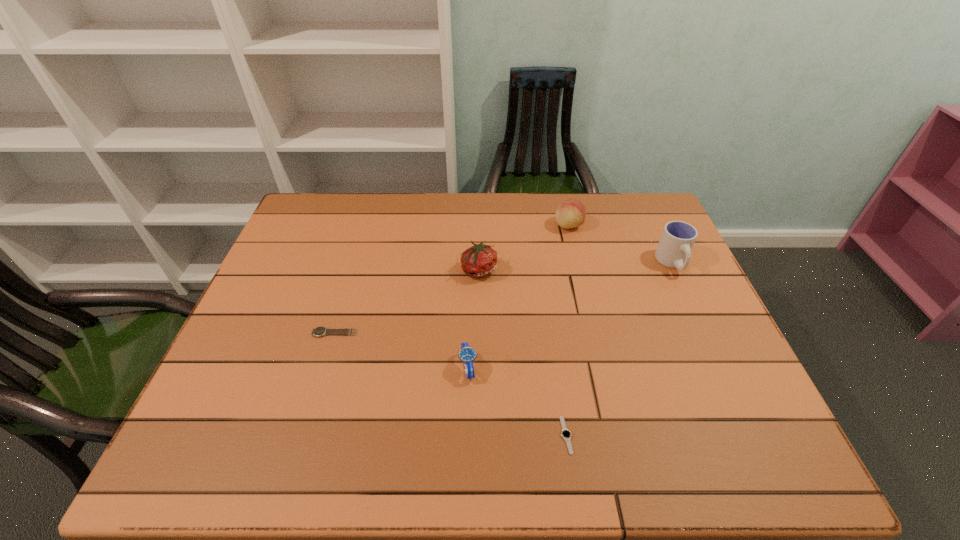
This screenshot has width=960, height=540. In order to click on free space between the nearest watch and the farthest watch in this screenshot , I will do `click(450, 384)`.

Identify the location of vacant point located between the rightmost object and the second nearest object. This screenshot has height=540, width=960. (570, 315).

I want to click on empty space that is in between the leftmost watch and the tomato, so click(407, 301).

The image size is (960, 540). Identify the location of vacant point located between the farthest object and the tomato. (524, 247).

You are a GUI agent. You are given a task and a screenshot of the screen. Output one action in this format:
    pyautogui.click(x=<x>, y=<y>)
    Task: Click on the free space between the third nearest object and the fifth object from left to right
    
    Given the screenshot: What is the action you would take?
    pyautogui.click(x=451, y=279)

The width and height of the screenshot is (960, 540). Identify the location of unoccupied position between the second nearest watch and the second object from right to left. (518, 296).

Locate which object is the second closest to the cup. Please provide its 2D coordinates. Your answer should be formatted as a tuple, i.e. [(x, y)], where the tuple contains the x and y coordinates of a point satisfying the conditions above.

[(480, 260)]

Identify which object is located as the fifth nearest to the second nearest watch. Please provide its 2D coordinates. Your answer should be formatted as a tuple, i.e. [(x, y)], where the tuple contains the x and y coordinates of a point satisfying the conditions above.

[(674, 249)]

Locate an element on the screen. watch that is the second closest one to the second watch from left to right is located at coordinates (320, 331).

Select which watch appears as the second closest to the fifth farthest object. Please provide its 2D coordinates. Your answer should be formatted as a tuple, i.e. [(x, y)], where the tuple contains the x and y coordinates of a point satisfying the conditions above.

[(320, 331)]